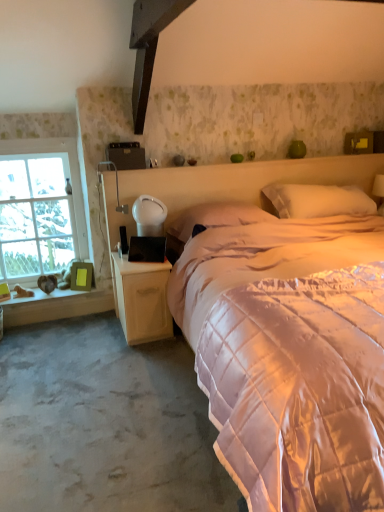
Question: Is white quilted pillow at upper center, the first pillow in the right-to-left sequence, surrounded by woodenwoodenwindow sill at left?

Choices:
 (A) no
 (B) yes

Answer: (A)

Question: Are woodenwoodenwindow sill at left and white quilted pillow at upper center, the first pillow in the right-to-left sequence, far apart?

Choices:
 (A) yes
 (B) no

Answer: (A)

Question: From a real-world perspective, is woodenwoodenwindow sill at left over white quilted pillow at upper center, the second pillow in the left-to-right sequence?

Choices:
 (A) yes
 (B) no

Answer: (B)

Question: From the image's perspective, does woodenwoodenwindow sill at left appear higher than white quilted pillow at upper center, the first pillow in the right-to-left sequence?

Choices:
 (A) yes
 (B) no

Answer: (B)

Question: Does woodenwoodenwindow sill at left have a lesser width compared to white quilted pillow at upper center, the second pillow in the left-to-right sequence?

Choices:
 (A) yes
 (B) no

Answer: (A)

Question: Considering the positions of clear glass window at left and woodenwoodenwindow sill at left in the image, is clear glass window at left bigger or smaller than woodenwoodenwindow sill at left?

Choices:
 (A) small
 (B) big

Answer: (B)

Question: In the image, is clear glass window at left positioned in front of or behind woodenwoodenwindow sill at left?

Choices:
 (A) front
 (B) behind

Answer: (A)

Question: From a real-world perspective, relative to woodenwoodenwindow sill at left, is clear glass window at left vertically above or below?

Choices:
 (A) below
 (B) above

Answer: (B)

Question: Considering the positions of clear glass window at left and woodenwoodenwindow sill at left in the image, is clear glass window at left wider or thinner than woodenwoodenwindow sill at left?

Choices:
 (A) thin
 (B) wide

Answer: (A)

Question: From a real-world perspective, relative to white quilted pillow at upper center, the second pillow in the left-to-right sequence, is wooden nightstand at lower left vertically above or below?

Choices:
 (A) below
 (B) above

Answer: (A)

Question: Would you say wooden nightstand at lower left is inside or outside white quilted pillow at upper center, the first pillow in the right-to-left sequence?

Choices:
 (A) outside
 (B) inside

Answer: (A)

Question: From the image's perspective, is wooden nightstand at lower left above or below white quilted pillow at upper center, the second pillow in the left-to-right sequence?

Choices:
 (A) below
 (B) above

Answer: (A)

Question: Would you say wooden nightstand at lower left is to the left or to the right of white quilted pillow at upper center, the first pillow in the right-to-left sequence, in the picture?

Choices:
 (A) right
 (B) left

Answer: (B)

Question: Is point (142, 199) closer or farther from the camera than point (21, 273)?

Choices:
 (A) closer
 (B) farther

Answer: (A)

Question: In terms of height, does white glossy table lamp at lower left, placed as the 1th table lamp when sorted from right to left, look taller or shorter compared to clear glass window at left?

Choices:
 (A) short
 (B) tall

Answer: (A)